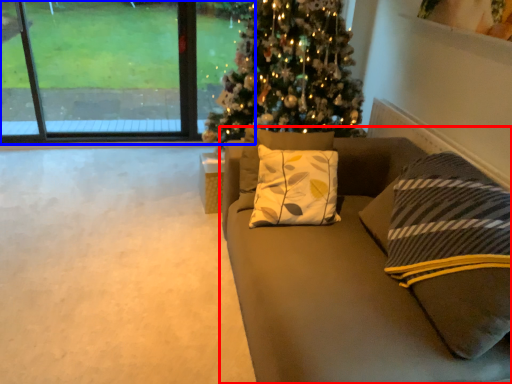
Question: Which object appears farthest to the camera in this image, studio couch (highlighted by a red box) or window (highlighted by a blue box)?

Choices:
 (A) studio couch
 (B) window

Answer: (B)